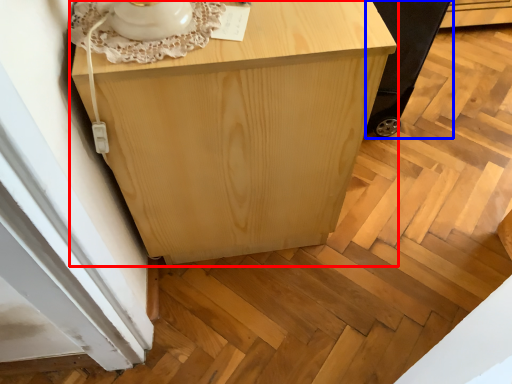
Question: Which of the following is the closest to the observer, furniture (highlighted by a red box) or baby carriage (highlighted by a blue box)?

Choices:
 (A) furniture
 (B) baby carriage

Answer: (A)